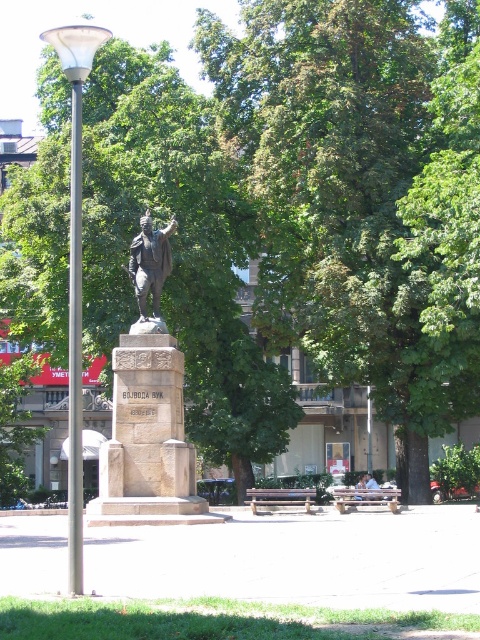
Between polished bronze statue at center and wooden park bench at center, which one is positioned lower?

wooden park bench at center is below.

In the scene shown: Does polished bronze statue at center appear over wooden park bench at center?

Indeed, polished bronze statue at center is positioned over wooden park bench at center.

Does point (133, 376) come closer to viewer compared to point (336, 499)?

Yes, it is.

Where is `polished bronze statue at center`? polished bronze statue at center is located at coordinates (147, 410).

Does wooden bench at center appear on the right side of light blue fabric shirt at center?

No, wooden bench at center is not to the right of light blue fabric shirt at center.

Which is below, wooden bench at center or light blue fabric shirt at center?

wooden bench at center

What do you see at coordinates (279, 497) in the screenshot? The image size is (480, 640). I see `wooden bench at center` at bounding box center [279, 497].

Locate an element on the screen. The width and height of the screenshot is (480, 640). wooden bench at center is located at coordinates (279, 497).

Does polished bronze statue at center have a larger size compared to light brown wooden bench at center?

Correct, polished bronze statue at center is larger in size than light brown wooden bench at center.

I want to click on polished bronze statue at center, so click(147, 410).

Locate an element on the screen. The width and height of the screenshot is (480, 640). polished bronze statue at center is located at coordinates (147, 410).